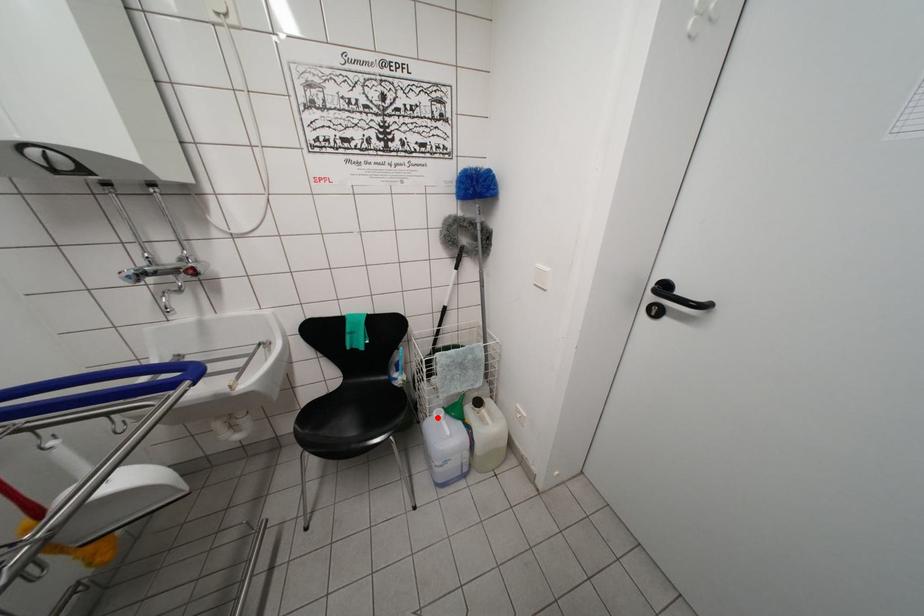
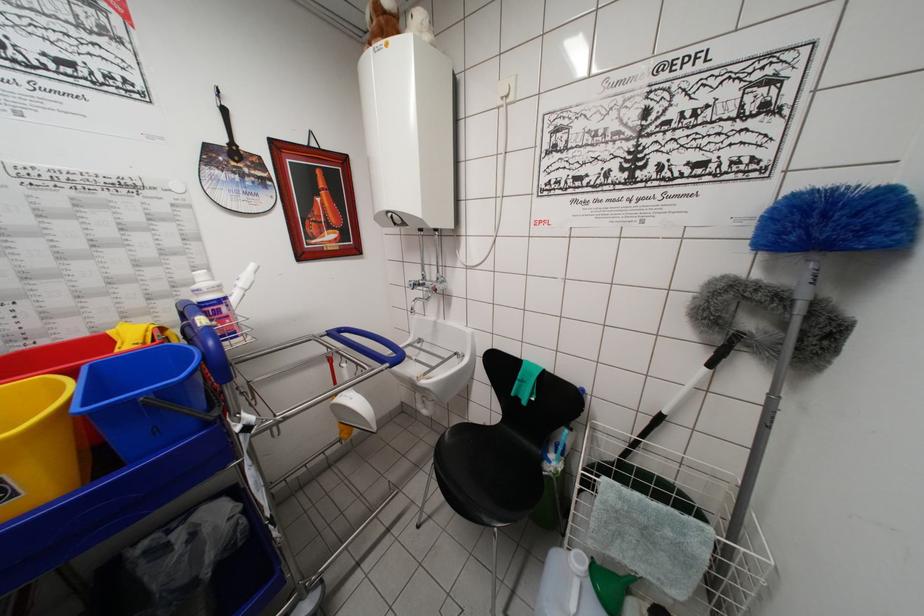
Question: I am providing you with two images of the same scene from different viewpoints. Image1 has a red point marked. In image2, the corresponding 3D location appears at what relative position? Reply with the corresponding letter.

Choices:
 (A) Closer
 (B) Farther

Answer: (A)